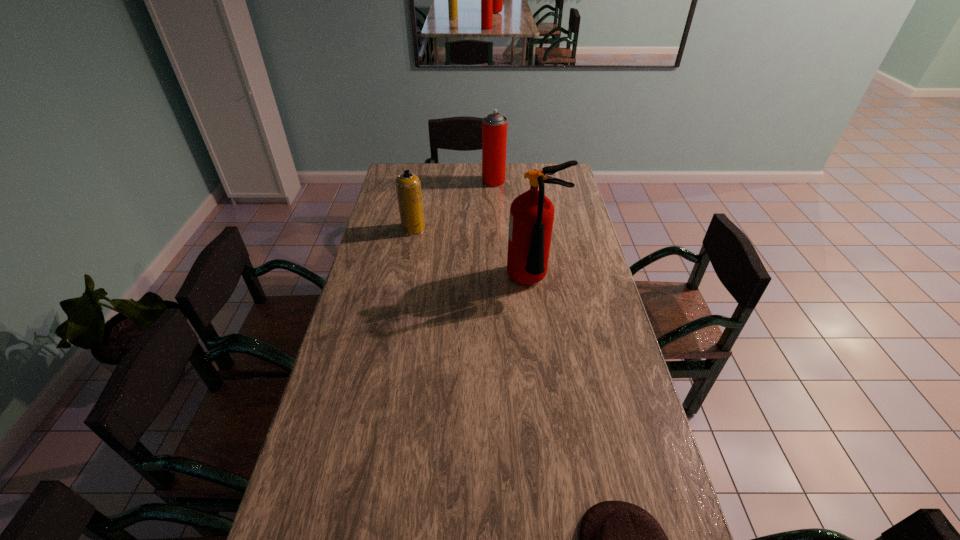
Identify the location of object that is positioned at the left edge. The width and height of the screenshot is (960, 540). pyautogui.click(x=408, y=186).

Locate an element on the screen. object that is positioned at the right edge is located at coordinates (531, 218).

Identify the location of free spot at the far edge of the desktop. pyautogui.click(x=447, y=170).

Where is `free space at the left edge of the desktop`? The height and width of the screenshot is (540, 960). free space at the left edge of the desktop is located at coordinates click(353, 364).

The image size is (960, 540). Identify the location of vacant region at the right edge. (575, 209).

Locate an element on the screen. The height and width of the screenshot is (540, 960). free spot between the nearer aerosol can and the second nearest object is located at coordinates (474, 255).

Identify the location of vacant region between the tallest object and the second shortest object. This screenshot has height=540, width=960. (474, 255).

You are a GUI agent. You are given a task and a screenshot of the screen. Output one action in this format:
    pyautogui.click(x=<x>, y=<y>)
    Task: Click on the free space between the fire extinguisher and the shorter aerosol can
    The height and width of the screenshot is (540, 960).
    Given the screenshot: What is the action you would take?
    pyautogui.click(x=474, y=255)

I want to click on object that stands as the second closest to the second nearest object, so click(x=494, y=126).

At what (x,y) coordinates should I click in order to perform the action: click on object that is the closest to the hat. Please return your answer as a coordinate pair (x, y). Looking at the image, I should click on (531, 218).